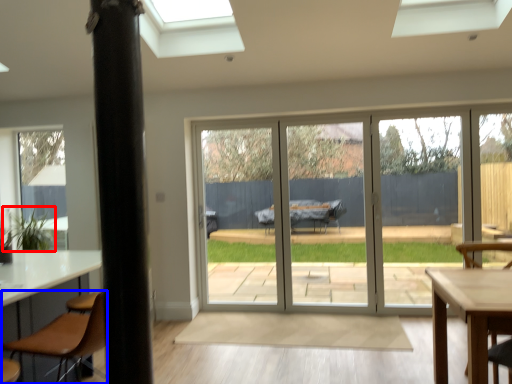
Question: Which point is closer to the camera, plant (highlighted by a red box) or chair (highlighted by a blue box)?

Choices:
 (A) plant
 (B) chair

Answer: (B)